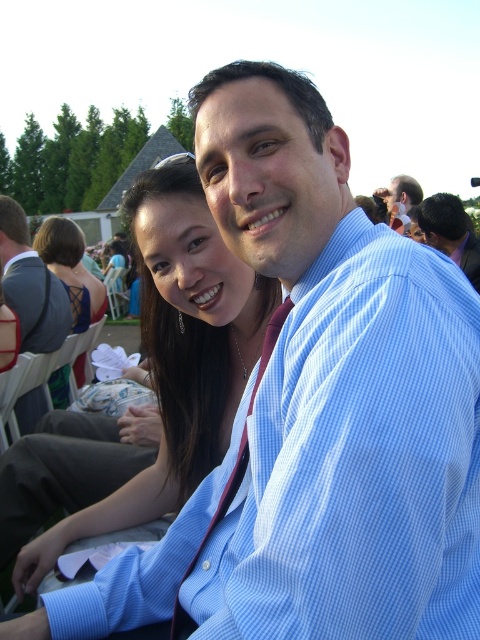
Question: Is matte black dress at left behind blue striped shirt at upper right?

Choices:
 (A) yes
 (B) no

Answer: (A)

Question: Which point is closer to the camera?

Choices:
 (A) matte black dress at center
 (B) gray fabric chair at left
 (C) matte black dress at left
 (D) blue striped shirt at upper right

Answer: (D)

Question: Which point is closer to the camera taking this photo?

Choices:
 (A) (71, 288)
 (B) (430, 212)
 (C) (7, 209)

Answer: (C)

Question: Considering the real-world distances, which object is farthest from the blue striped shirt at upper right?

Choices:
 (A) matte black dress at center
 (B) gray fabric chair at left
 (C) matte black dress at left

Answer: (C)

Question: Is matte black dress at center closer to the viewer compared to matte black dress at left?

Choices:
 (A) no
 (B) yes

Answer: (B)

Question: Observing the image, what is the correct spatial positioning of matte black dress at left in reference to blue striped shirt at upper right?

Choices:
 (A) right
 (B) left

Answer: (B)